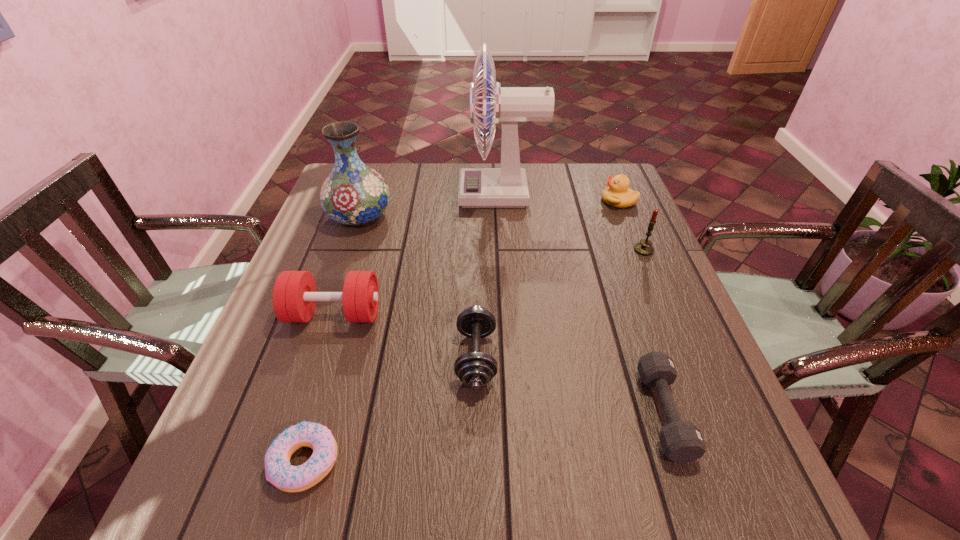
The width and height of the screenshot is (960, 540). In order to click on free space between the fifth nearest object and the rightmost dumbbell in this screenshot , I will do `click(654, 331)`.

Find the location of a particular element. This screenshot has width=960, height=540. unoccupied position between the leftmost dumbbell and the shortest object is located at coordinates (321, 388).

This screenshot has height=540, width=960. I want to click on free space between the shortest object and the vase, so click(333, 339).

Locate an element on the screen. The height and width of the screenshot is (540, 960). vacant area between the second dumbbell from left to right and the vase is located at coordinates (419, 287).

Image resolution: width=960 pixels, height=540 pixels. Identify the location of vacant area that lies between the candle and the duckling. (632, 225).

Locate an element on the screen. The height and width of the screenshot is (540, 960). free space between the duckling and the fan is located at coordinates (560, 198).

Find the location of a particular element. free space between the shortest object and the tallest dumbbell is located at coordinates (321, 388).

Where is `free spot between the candle and the duckling`? This screenshot has width=960, height=540. free spot between the candle and the duckling is located at coordinates (632, 225).

Identify the location of vacant area that lies between the candle and the duckling. The image size is (960, 540). (632, 225).

The height and width of the screenshot is (540, 960). What are the coordinates of `object that ranks as the fifth closest to the rightmost dumbbell` in the screenshot? It's located at (278, 470).